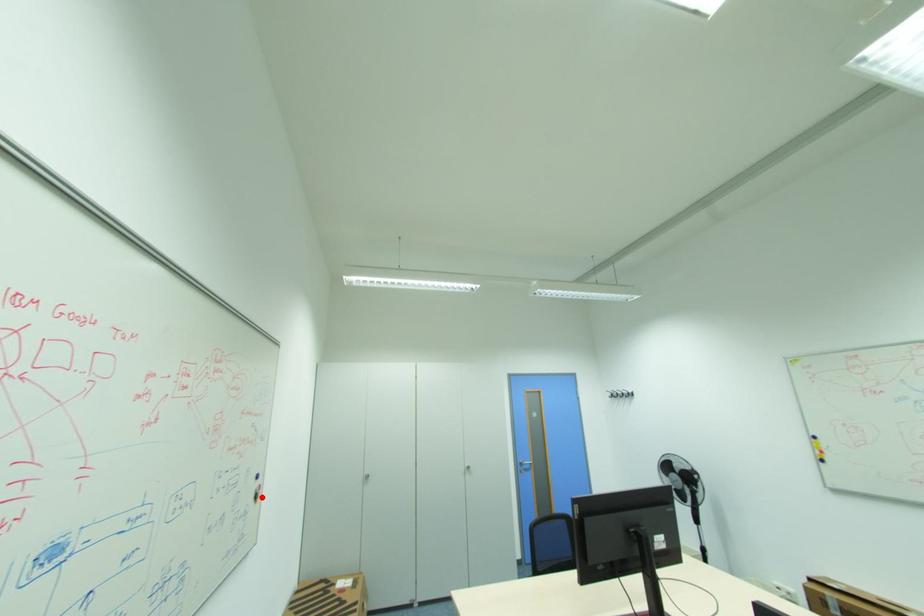
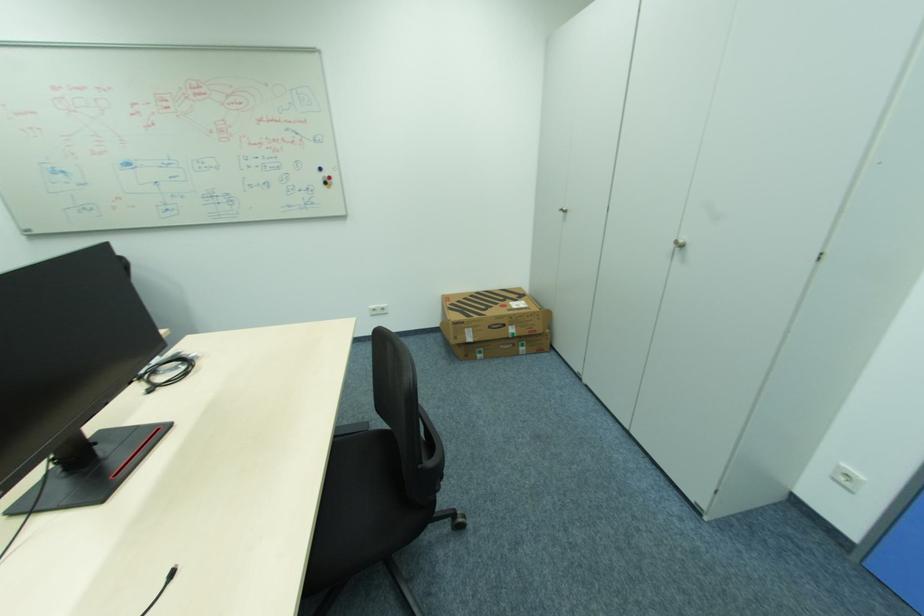
Question: I am providing you with two images of the same scene from different viewpoints. Given a red point in image1, look at the same physical point in image2. Is it:

Choices:
 (A) Closer to the viewpoint
 (B) Farther from the viewpoint

Answer: (A)